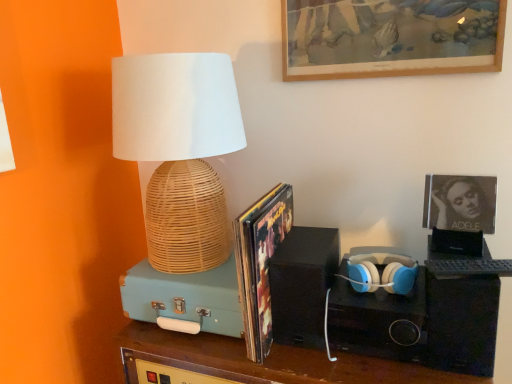
Question: Considering the relative sizes of matte white and blue plastic headphones at center right and matte black album cover at upper right, which ranks as the first picture frame in bottom-to-top order, in the image provided, is matte white and blue plastic headphones at center right shorter than matte black album cover at upper right, which ranks as the first picture frame in bottom-to-top order,?

Choices:
 (A) yes
 (B) no

Answer: (A)

Question: Considering the relative sizes of matte white and blue plastic headphones at center right and matte black album cover at upper right, which ranks as the second picture frame in top-to-bottom order, in the image provided, is matte white and blue plastic headphones at center right thinner than matte black album cover at upper right, which ranks as the second picture frame in top-to-bottom order,?

Choices:
 (A) yes
 (B) no

Answer: (B)

Question: Does matte white and blue plastic headphones at center right have a greater width compared to matte black album cover at upper right, which ranks as the second picture frame in top-to-bottom order?

Choices:
 (A) no
 (B) yes

Answer: (B)

Question: From the image's perspective, is matte white and blue plastic headphones at center right above matte black album cover at upper right, which ranks as the first picture frame in bottom-to-top order?

Choices:
 (A) no
 (B) yes

Answer: (A)

Question: From the image's perspective, would you say matte white and blue plastic headphones at center right is shown under matte black album cover at upper right, which ranks as the second picture frame in top-to-bottom order?

Choices:
 (A) no
 (B) yes

Answer: (B)

Question: From their relative heights in the image, would you say black matte speaker at right, which appears as the first speaker when viewed from the right, is taller or shorter than wooden picture frame at upper center, the 2th picture frame in the bottom-to-top sequence?

Choices:
 (A) tall
 (B) short

Answer: (A)

Question: Would you say black matte speaker at right, the 3th speaker positioned from the left, is to the left or to the right of wooden picture frame at upper center, marked as the first picture frame in a top-to-bottom arrangement, in the picture?

Choices:
 (A) right
 (B) left

Answer: (A)

Question: In terms of size, does black matte speaker at right, which appears as the first speaker when viewed from the right, appear bigger or smaller than wooden picture frame at upper center, the 2th picture frame in the bottom-to-top sequence?

Choices:
 (A) big
 (B) small

Answer: (A)

Question: Does point (435, 291) appear closer or farther from the camera than point (488, 61)?

Choices:
 (A) farther
 (B) closer

Answer: (B)

Question: Is black matte speaker at center, which is the second speaker from left to right, wider or thinner than teal matte suitcase at left, which is the 1th speaker from left to right?

Choices:
 (A) wide
 (B) thin

Answer: (B)

Question: Considering the positions of black matte speaker at center, marked as the second speaker in a right-to-left arrangement, and teal matte suitcase at left, which appears as the 3th speaker when viewed from the right, in the image, is black matte speaker at center, marked as the second speaker in a right-to-left arrangement, bigger or smaller than teal matte suitcase at left, which appears as the 3th speaker when viewed from the right,?

Choices:
 (A) small
 (B) big

Answer: (A)

Question: Considering the positions of point (290, 263) and point (229, 319), is point (290, 263) closer or farther from the camera than point (229, 319)?

Choices:
 (A) closer
 (B) farther

Answer: (A)

Question: From the image's perspective, is black matte speaker at center, marked as the second speaker in a right-to-left arrangement, located above or below teal matte suitcase at left, which appears as the 3th speaker when viewed from the right?

Choices:
 (A) below
 (B) above

Answer: (B)

Question: Is shiny paper magazine at center wider or thinner than black matte speaker at center, which is the second speaker from left to right?

Choices:
 (A) thin
 (B) wide

Answer: (B)

Question: Is shiny paper magazine at center in front of or behind black matte speaker at center, marked as the second speaker in a right-to-left arrangement, in the image?

Choices:
 (A) front
 (B) behind

Answer: (A)